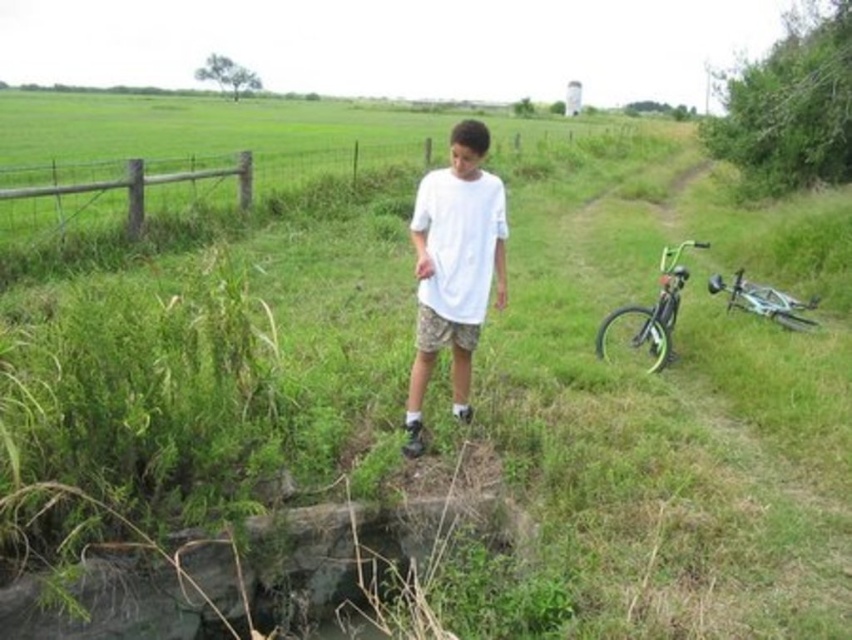
The width and height of the screenshot is (852, 640). Describe the element at coordinates (763, 301) in the screenshot. I see `metallic silver bicycle at right` at that location.

Who is shorter, metallic silver bicycle at right or camouflage fabric shorts at center?

camouflage fabric shorts at center

Between point (816, 323) and point (464, 337), which one is positioned in front?

Point (464, 337) is more forward.

Locate an element on the screen. metallic silver bicycle at right is located at coordinates (763, 301).

Does rocky concrete at lower left have a lesser height compared to white matte shirt at center?

Indeed, rocky concrete at lower left has a lesser height compared to white matte shirt at center.

Locate an element on the screen. This screenshot has width=852, height=640. rocky concrete at lower left is located at coordinates (335, 552).

Between wooden fence at left and green matte bicycle at right, which one appears on the right side from the viewer's perspective?

wooden fence at left

Can you confirm if wooden fence at left is thinner than green matte bicycle at right?

No.

You are a GUI agent. You are given a task and a screenshot of the screen. Output one action in this format:
    pyautogui.click(x=<x>, y=<y>)
    Task: Click on the wooden fence at left
    The image size is (852, 640).
    Given the screenshot: What is the action you would take?
    pyautogui.click(x=272, y=173)